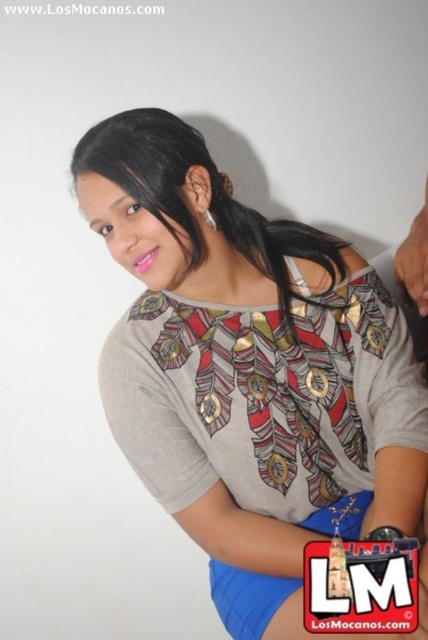
Is printed fabric blouse at center positioned in front of black shiny hair at upper center?

That is True.

Which is below, printed fabric blouse at center or black shiny hair at upper center?

printed fabric blouse at center is below.

This screenshot has height=640, width=428. Find the location of `printed fabric blouse at center`. printed fabric blouse at center is located at coordinates (249, 371).